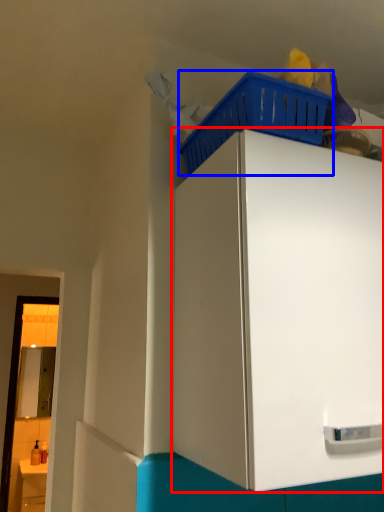
Question: Which object appears closest to the camera in this image, cabinetry (highlighted by a red box) or basket (highlighted by a blue box)?

Choices:
 (A) cabinetry
 (B) basket

Answer: (A)